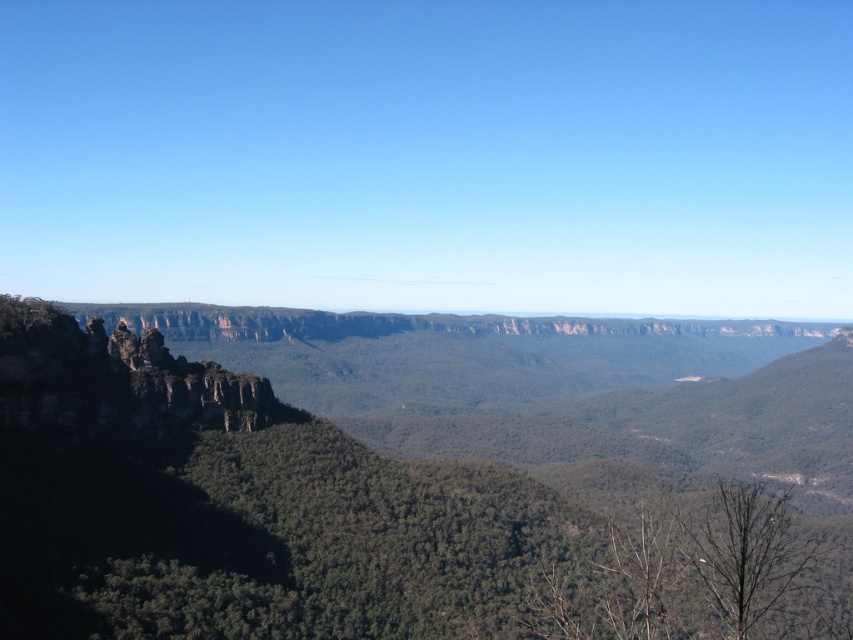
Who is higher up, rugged rock formation at left or rugged stone rock formation at left?

rugged stone rock formation at left

Can you confirm if rugged rock formation at left is smaller than rugged stone rock formation at left?

Incorrect, rugged rock formation at left is not smaller in size than rugged stone rock formation at left.

Between point (175, 426) and point (49, 328), which one is positioned in front?

Point (49, 328)

This screenshot has width=853, height=640. In order to click on rugged rock formation at left in this screenshot , I will do `click(407, 502)`.